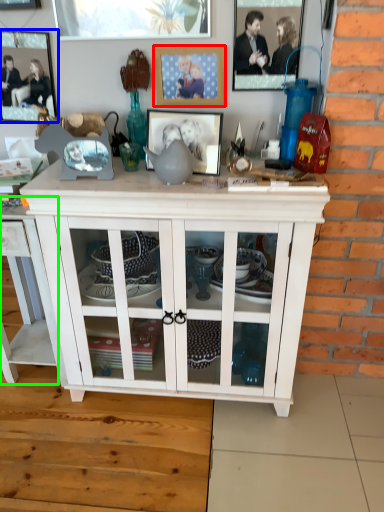
Question: Which object is the closest to the picture frame (highlighted by a red box)? Choose among these: picture frame (highlighted by a blue box) or table (highlighted by a green box).

Choices:
 (A) picture frame
 (B) table

Answer: (A)